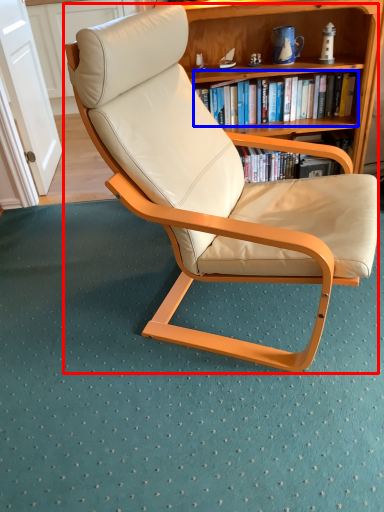
Question: Which object appears closest to the camera in this image, chair (highlighted by a red box) or book (highlighted by a blue box)?

Choices:
 (A) chair
 (B) book

Answer: (A)